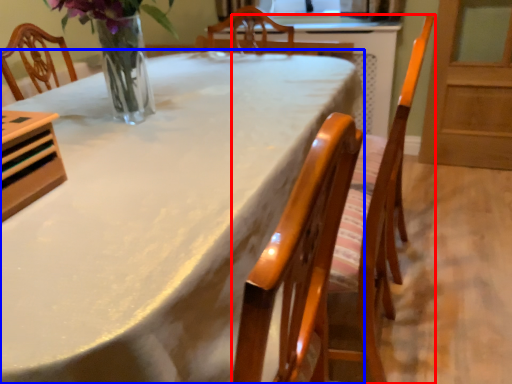
Question: Which object appears closest to the camera in this image, chair (highlighted by a red box) or table (highlighted by a blue box)?

Choices:
 (A) chair
 (B) table

Answer: (B)